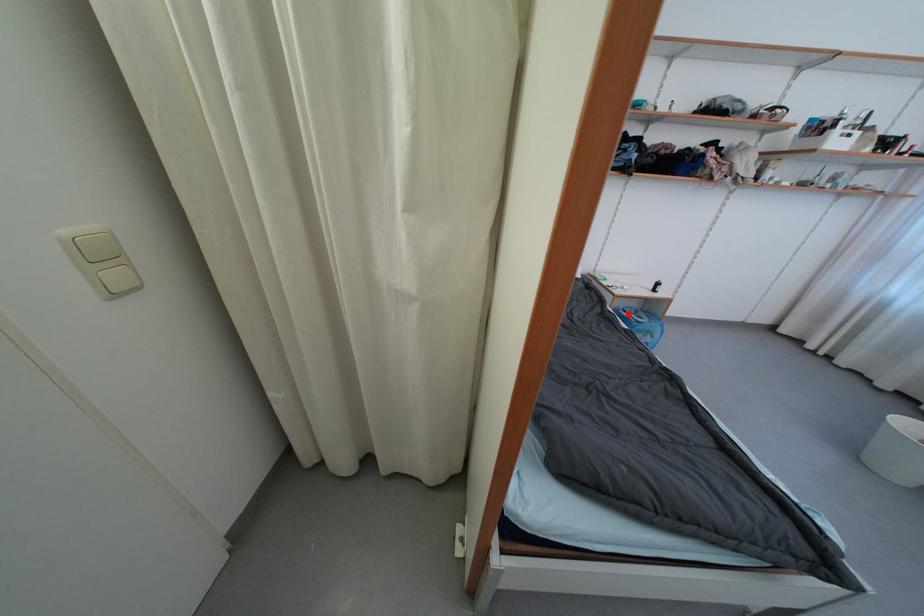
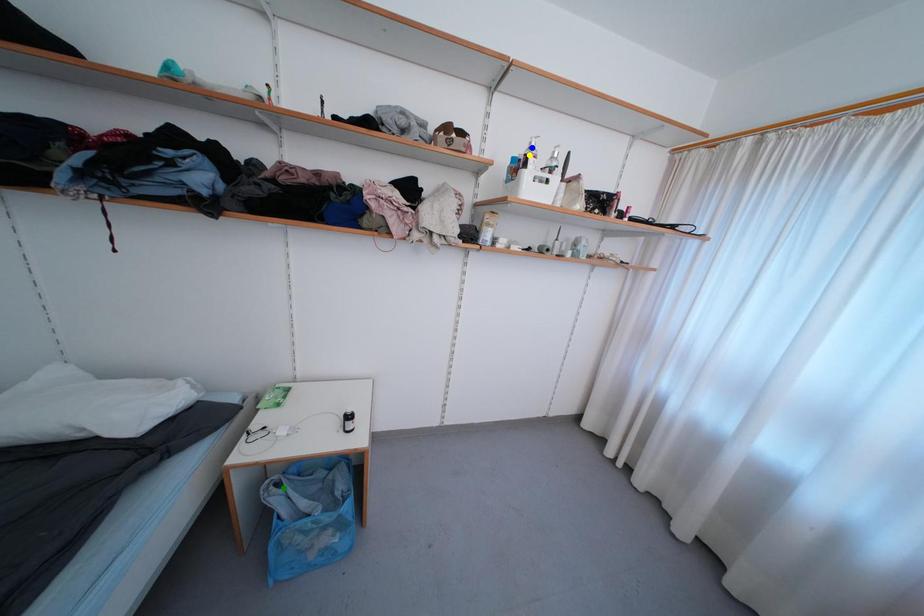
Question: I am providing you with two images of the same scene from different viewpoints. A red point is marked on the first image. You are given multiple points on the second image. Which mark in image 2 goes with the point in image 1?

Choices:
 (A) blue point
 (B) yellow point
 (C) green point

Answer: (C)